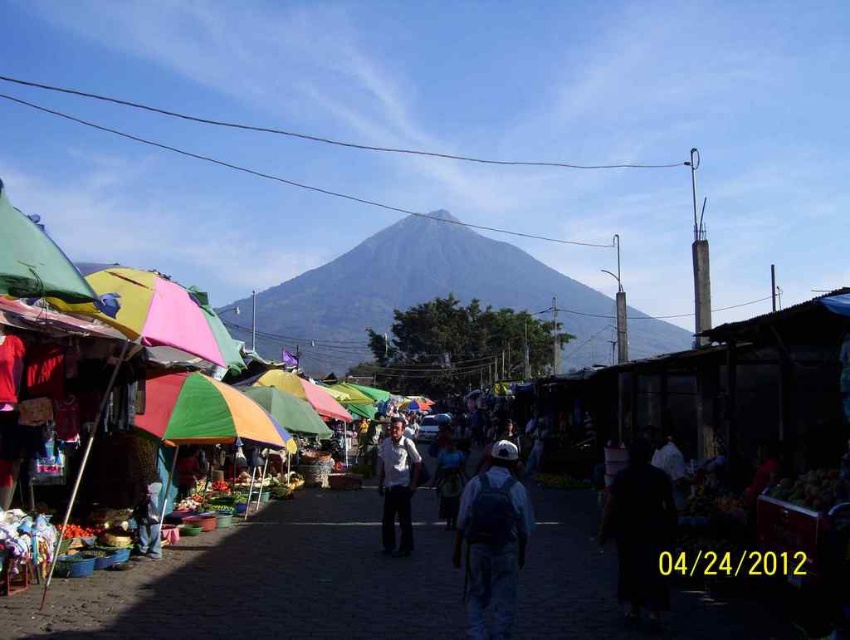
You are a photographer standing at the edge of the market. You want to take a photo that includes both the gray matte mountain at center and the blue denim jeans at lower left. Which object will appear closer to the camera in the photo?

The gray matte mountain at center will appear closer to the camera in the photo because it is positioned further to the viewer than the blue denim jeans at lower left.

You are standing at the entrance of the market and see the black matte person at center and the blue denim jeans at lower left. Which object is closer to you?

The black matte person at center is closer to you because it is in front of the blue denim jeans at lower left.